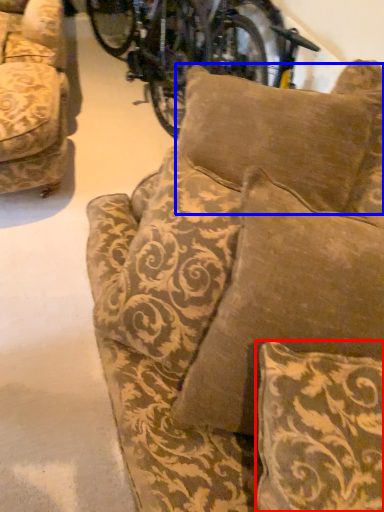
Question: Which object is further to the camera taking this photo, pillow (highlighted by a red box) or pillow (highlighted by a blue box)?

Choices:
 (A) pillow
 (B) pillow

Answer: (B)